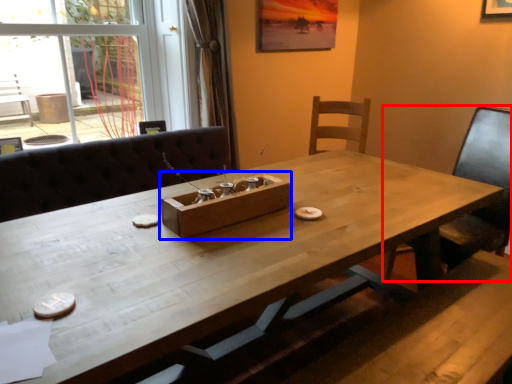
Question: Which object appears farthest to the camera in this image, chair (highlighted by a red box) or cardboard box (highlighted by a blue box)?

Choices:
 (A) chair
 (B) cardboard box

Answer: (A)